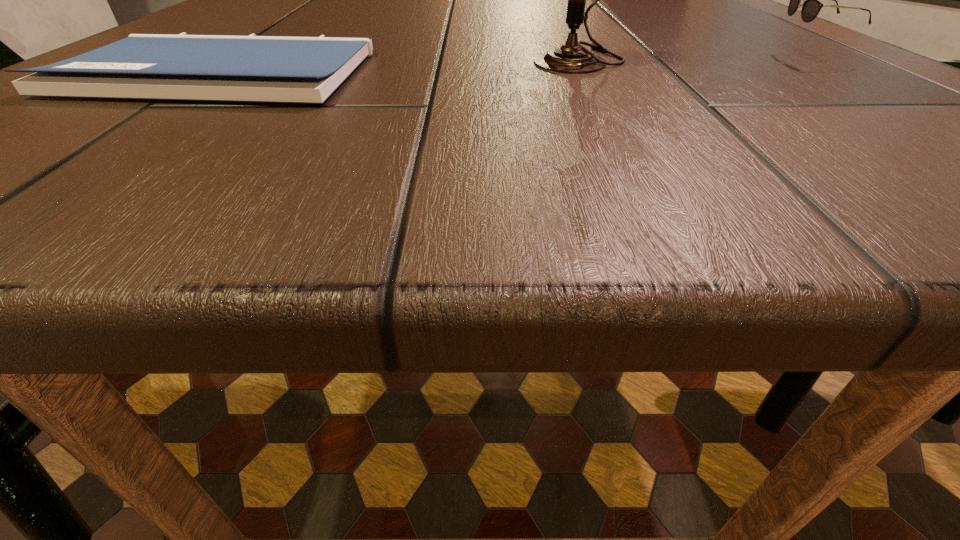
This screenshot has width=960, height=540. Find the location of `the tallest object`. the tallest object is located at coordinates (571, 58).

The image size is (960, 540). Identify the location of the second object from right to left. (571, 58).

The height and width of the screenshot is (540, 960). Identify the location of sunglasses. (812, 5).

Find the location of a particular element. the second shortest object is located at coordinates (812, 5).

Image resolution: width=960 pixels, height=540 pixels. In order to click on the leftmost object in this screenshot , I will do `click(243, 68)`.

Identify the location of the shortest object. (243, 68).

At what (x,y) coordinates should I click in order to perform the action: click on blank space located on the front-facing side of the second object from right to left. Please return your answer as a coordinate pair (x, y). The height and width of the screenshot is (540, 960). Looking at the image, I should click on (454, 60).

The height and width of the screenshot is (540, 960). I want to click on vacant space situated 0.070m on the front-facing side of the second object from right to left, so [472, 60].

Identify the location of vacant region located on the front-facing side of the second object from right to left. (454, 60).

Locate an element on the screen. free space located in front of the lenses of the rightmost object is located at coordinates (494, 57).